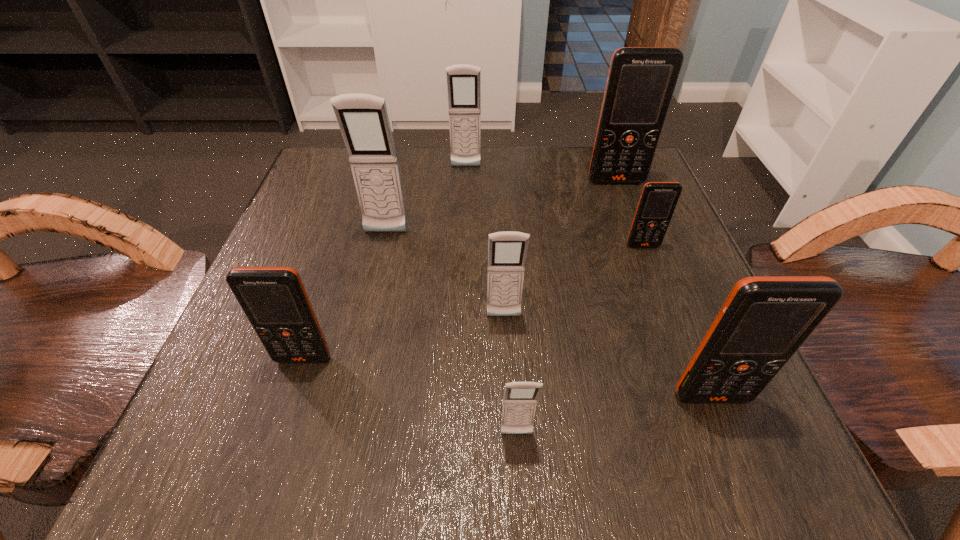
This screenshot has width=960, height=540. In order to click on the biggest orange cellular telephone in this screenshot , I will do `click(641, 81)`.

Locate an element on the screen. Image resolution: width=960 pixels, height=540 pixels. the farthest orange cellular telephone is located at coordinates (641, 81).

Image resolution: width=960 pixels, height=540 pixels. What are the coordinates of `the leftmost gray cellular telephone` in the screenshot? It's located at (363, 119).

This screenshot has height=540, width=960. What are the coordinates of `the third farthest object` in the screenshot? It's located at (363, 119).

You are a GUI agent. You are given a task and a screenshot of the screen. Output one action in this format:
    pyautogui.click(x=<x>, y=<y>)
    Task: Click on the sixth cellular telephone from right to left
    
    Given the screenshot: What is the action you would take?
    tap(463, 81)

You are a GUI agent. You are given a task and a screenshot of the screen. Output one action in this format:
    pyautogui.click(x=<x>, y=<y>)
    Task: Click on the farthest gray cellular telephone
    
    Given the screenshot: What is the action you would take?
    pyautogui.click(x=463, y=81)

Where is `the seventh farthest object`? This screenshot has width=960, height=540. the seventh farthest object is located at coordinates (764, 320).

This screenshot has width=960, height=540. What are the coordinates of `the third smallest orange cellular telephone` in the screenshot? It's located at (764, 320).

Identify the location of the fifth farthest cellular telephone. This screenshot has width=960, height=540. pos(507,251).

Identify the location of the third farthest gray cellular telephone. The height and width of the screenshot is (540, 960). (507, 251).